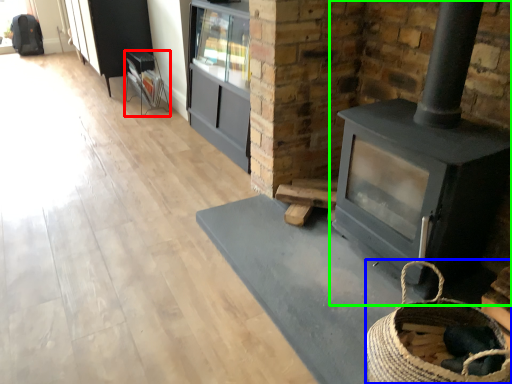
Question: Which object is the farthest from furniture (highlighted by a red box)? Choose among these: basket (highlighted by a blue box) or wood burning stove (highlighted by a green box).

Choices:
 (A) basket
 (B) wood burning stove

Answer: (A)